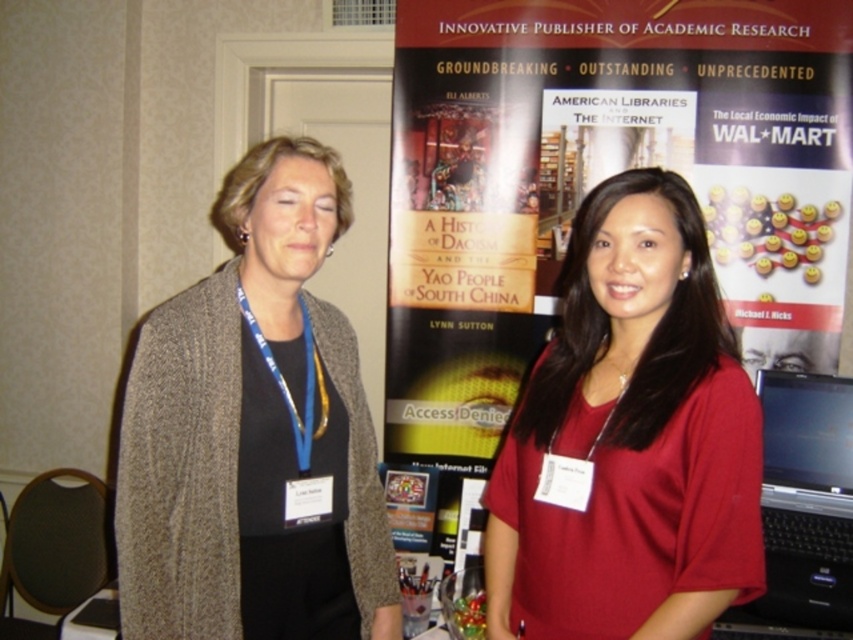
Which is below, knit cardigan at left or matte red shirt at center?

Positioned lower is matte red shirt at center.

In the scene shown: Can you confirm if knit cardigan at left is thinner than matte red shirt at center?

No.

Image resolution: width=853 pixels, height=640 pixels. Find the location of `knit cardigan at left`. knit cardigan at left is located at coordinates (251, 433).

Can you confirm if matte black banner at center is bigger than knit cardigan at left?

Correct, matte black banner at center is larger in size than knit cardigan at left.

Who is taller, matte black banner at center or knit cardigan at left?

Standing taller between the two is matte black banner at center.

Find the location of `matte black banner at center`. matte black banner at center is located at coordinates (602, 179).

Is point (494, 0) positioned behind point (547, 344)?

Yes.

Is matte black banner at center thinner than matte red shirt at center?

No.

Locate an element on the screen. matte black banner at center is located at coordinates (602, 179).